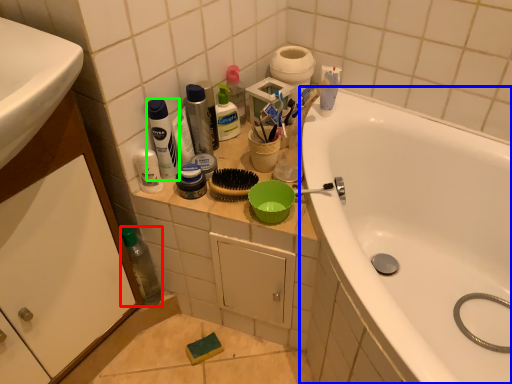
Question: Which is nearer to the bottle (highlighted by a red box)? bathtub (highlighted by a blue box) or cleaning product (highlighted by a green box).

Choices:
 (A) bathtub
 (B) cleaning product

Answer: (B)